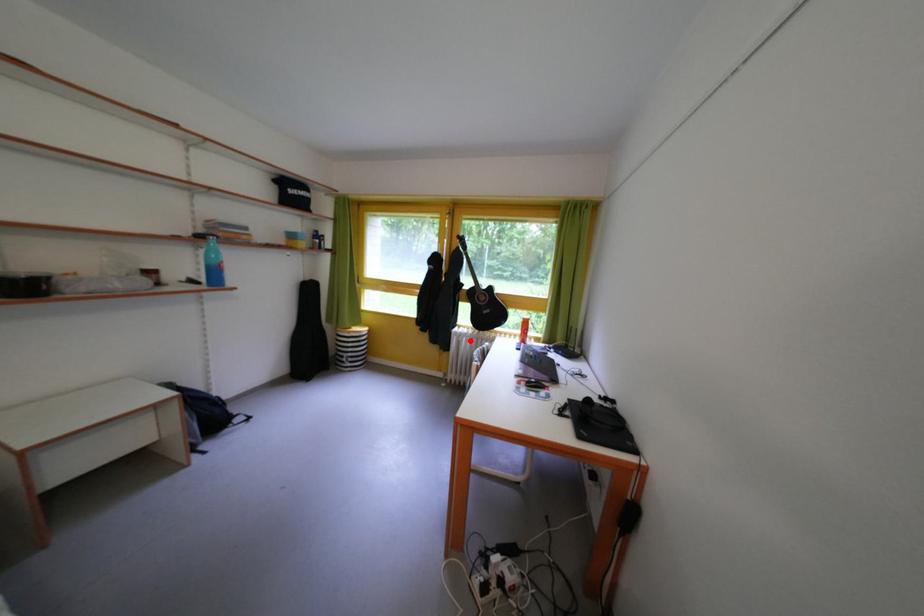
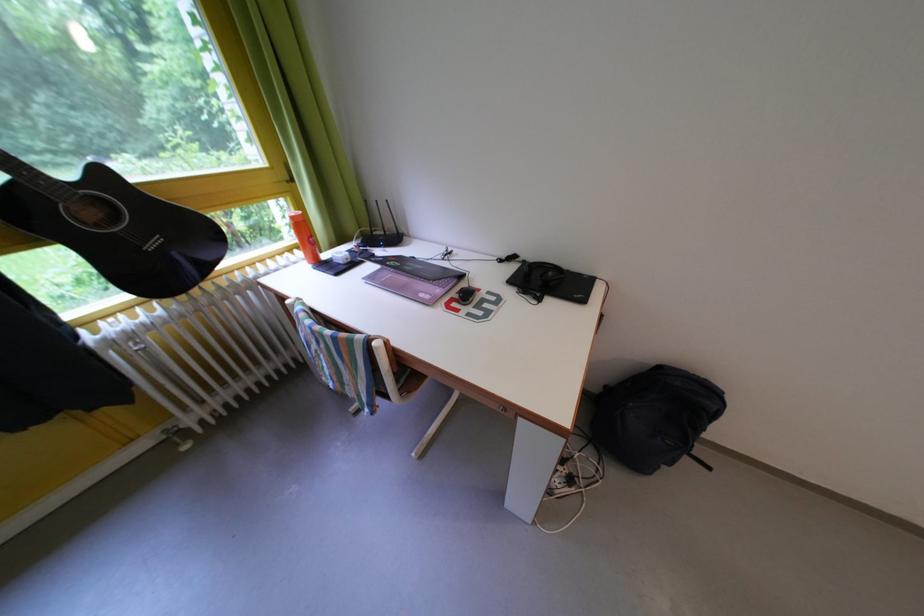
The point at the highlighted location is marked in the first image. Where is the corresponding point in the second image?

(140, 342)